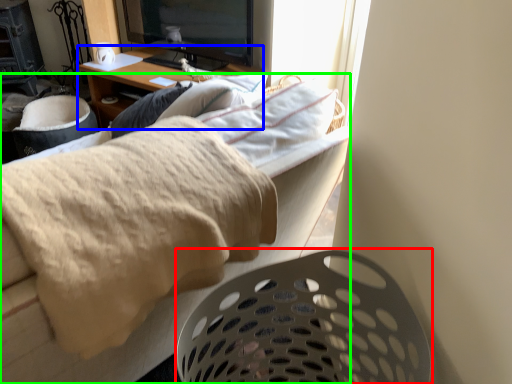
Question: Which object is the closest to the laundry basket (highlighted by a red box)? Choose among these: desk (highlighted by a blue box) or furniture (highlighted by a green box).

Choices:
 (A) desk
 (B) furniture

Answer: (B)